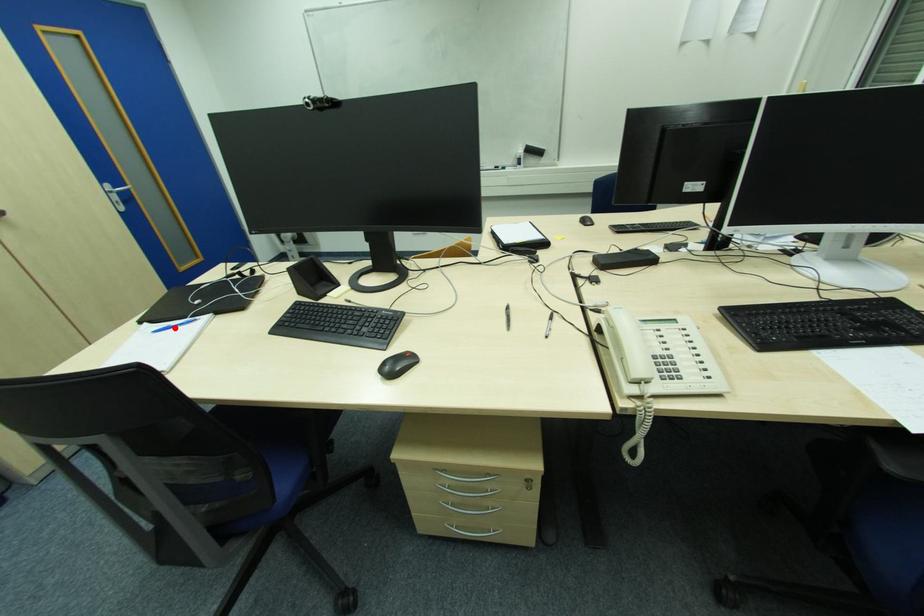
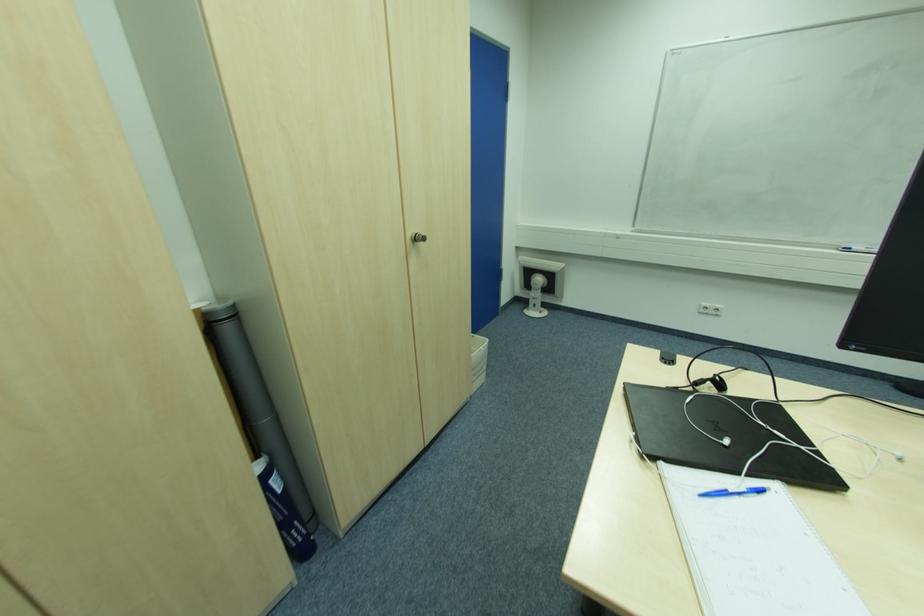
Question: I am providing you with two images of the same scene from different viewpoints. A red point is marked on the first image. Is the red point's position out of view in image 2?

Choices:
 (A) Yes
 (B) No

Answer: (B)